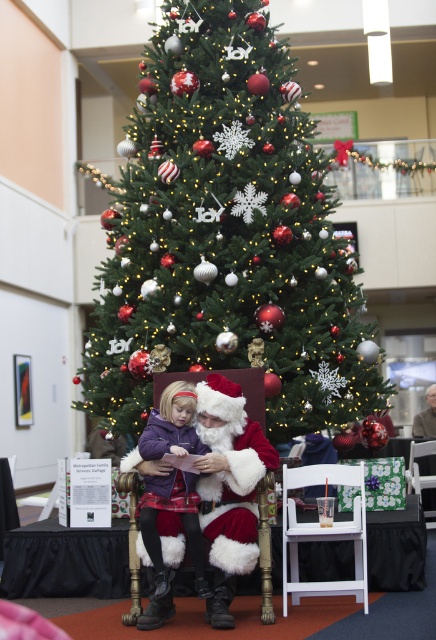
You are a visitor in the room and want to take a photo of the green matte christmas tree at center and the white wood armchair at lower right together in the frame. Based on their positions, will you need to adjust your camera angle upwards or downwards to include both in the photo?

The green matte christmas tree at center is above the white wood armchair at lower right, so you will need to tilt your camera upwards to capture both in the same frame.

Please provide the coordinates of the purple fleece jacket at center in the image.

The purple fleece jacket at center is located at coordinates point (160,538).